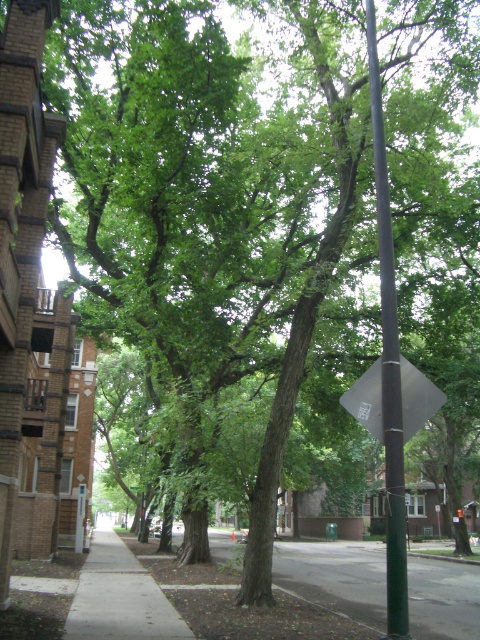
You are standing at the center of the street and want to place a small bench exactly at the coordinates where the green metallic pole at center is located. Is this possible?

The green metallic pole at center is located at coordinates point (388, 364), so placing a bench there would not be possible as the pole is already occupying that exact position.